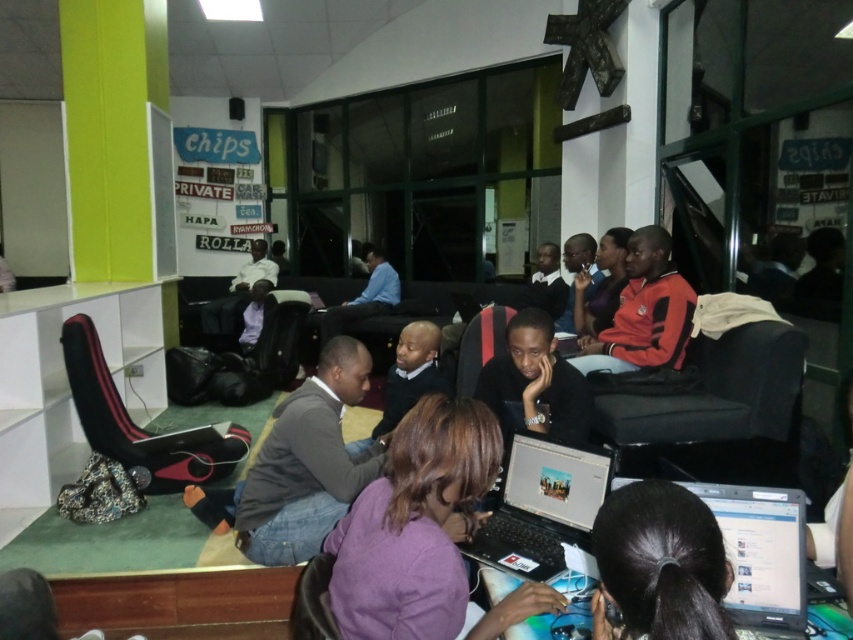
Question: Estimate the real-world distances between objects in this image. Which object is farther from the purple matte laptop at center?

Choices:
 (A) silver metallic laptop at lower right
 (B) black glossy hair at lower center
 (C) black matte laptop at center
 (D) orange fleece jacket at center

Answer: (D)

Question: Estimate the real-world distances between objects in this image. Which object is closer to the purple matte laptop at center?

Choices:
 (A) silver metallic laptop at lower right
 (B) orange fleece jacket at center

Answer: (A)

Question: Can you confirm if orange fleece jacket at center is positioned to the left of black matte laptop at center?

Choices:
 (A) no
 (B) yes

Answer: (A)

Question: Does silver metallic laptop at lower right have a lesser width compared to black matte laptop at center?

Choices:
 (A) yes
 (B) no

Answer: (A)

Question: Which of the following is the farthest from the observer?

Choices:
 (A) black glossy hair at lower center
 (B) purple matte laptop at center

Answer: (B)

Question: Does purple matte laptop at center appear over silver metallic laptop at center?

Choices:
 (A) no
 (B) yes

Answer: (B)